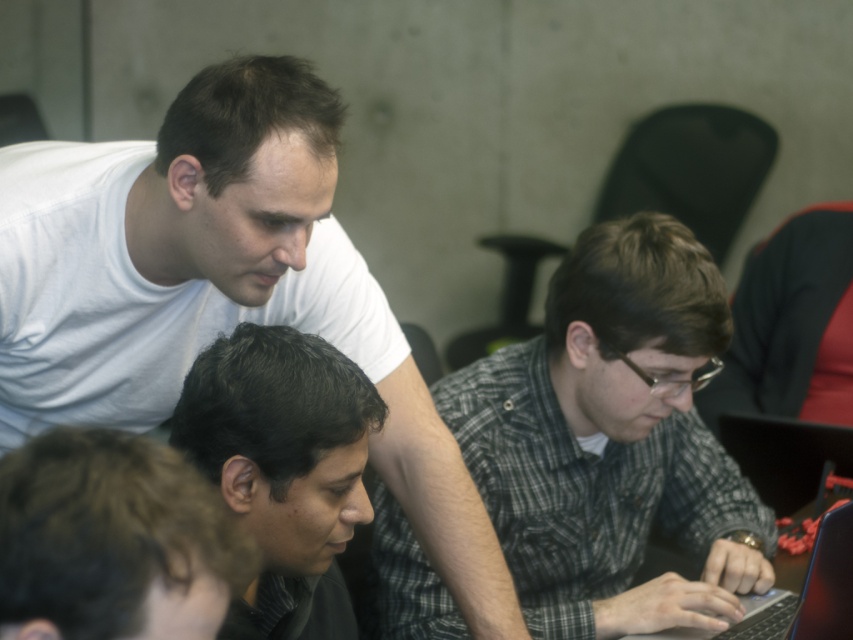
You are standing in front of the laptop screen where the three men are working. There are two points marked on the screen at coordinates point (90, 419) and point (810, 637). Which point is closer to you?

Point (90, 419) is further to the camera than point (810, 637), so the point closer to you is point (810, 637).

You are a photographer trying to capture a candid shot of the checkered fabric shirt at center and the dark gray checkered shirt at lower center. Since you want to ensure both are in focus, you need to know their vertical positions. Which one is lower in the frame?

The checkered fabric shirt at center is positioned under the dark gray checkered shirt at lower center, so the dark gray checkered shirt at lower center is lower in the frame.